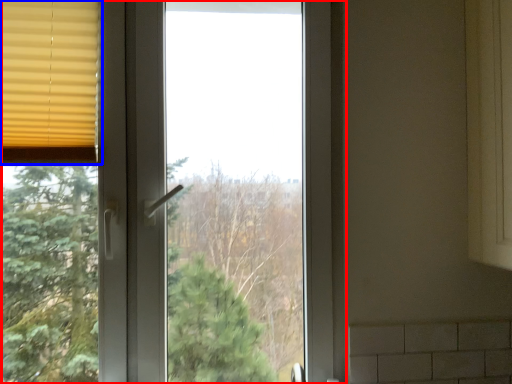
Question: Which of the following is the farthest to the observer, window (highlighted by a red box) or window blind (highlighted by a blue box)?

Choices:
 (A) window
 (B) window blind

Answer: (B)